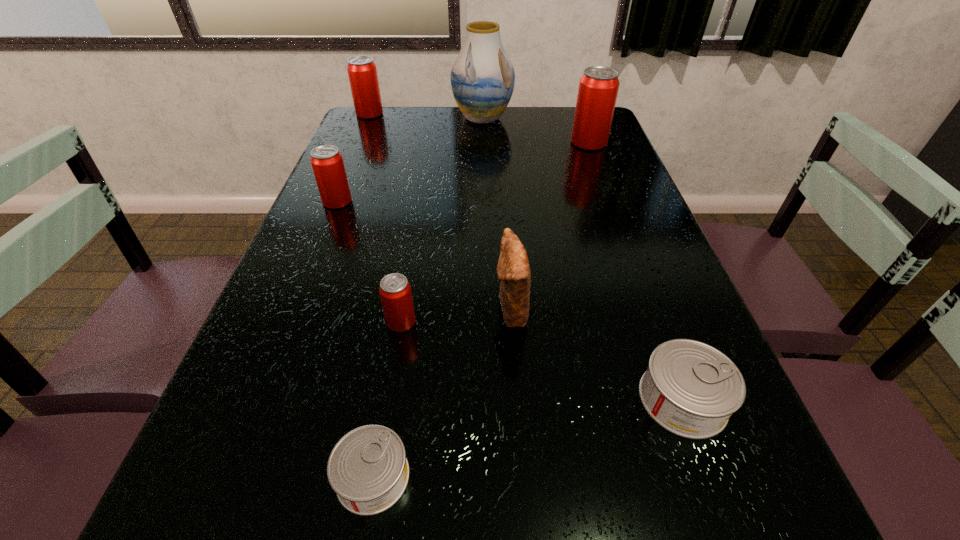
You are a GUI agent. You are given a task and a screenshot of the screen. Output one action in this format:
    pyautogui.click(x=<x>, y=<y>)
    Task: Click on the free space in the image that satisfies the following two spatial constraints: 1. on the back side of the nearest can; 2. on the left side of the second nearest object
    
    Given the screenshot: What is the action you would take?
    pyautogui.click(x=386, y=399)